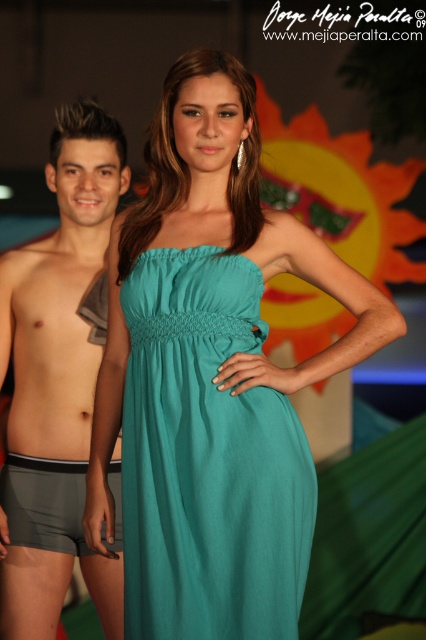
Question: Is teal satin dress at center further to the viewer compared to gray fabric shorts at lower left?

Choices:
 (A) yes
 (B) no

Answer: (B)

Question: Among these points, which one is nearest to the camera?

Choices:
 (A) (3, 477)
 (B) (48, 445)
 (C) (39, 243)

Answer: (B)

Question: Is teal fabric dress at center below gray matte shorts at left?

Choices:
 (A) yes
 (B) no

Answer: (B)

Question: Is skinny gray shorts at left to the left of gray fabric shorts at lower left from the viewer's perspective?

Choices:
 (A) no
 (B) yes

Answer: (B)

Question: Which object is the closest to the gray matte shorts at left?

Choices:
 (A) gray fabric shorts at lower left
 (B) teal fabric dress at center

Answer: (A)

Question: Which object appears closest to the camera in this image?

Choices:
 (A) gray fabric shorts at lower left
 (B) skinny gray shorts at left

Answer: (A)